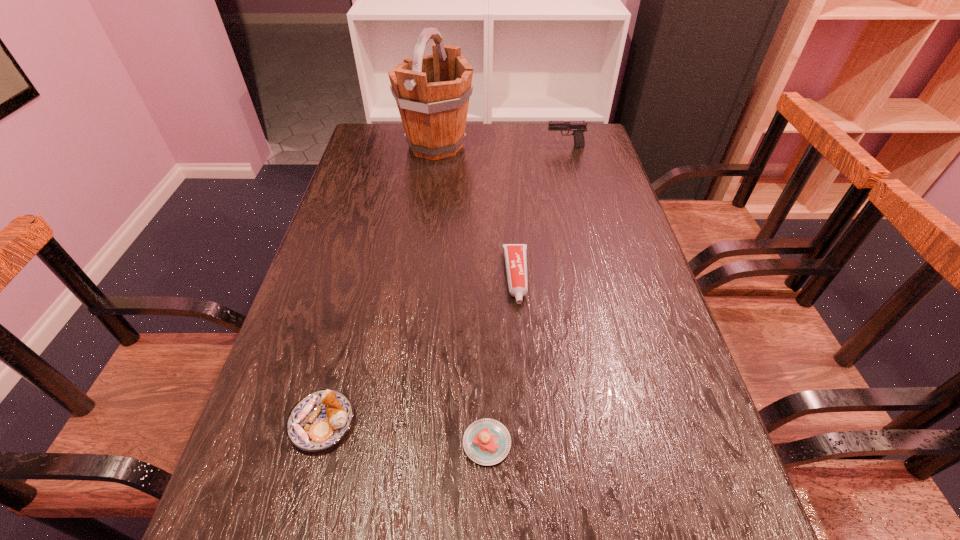
Locate an element on the screen. This screenshot has width=960, height=540. object at the far left corner is located at coordinates (432, 92).

Identify the location of object that is at the far right corner. The height and width of the screenshot is (540, 960). (578, 127).

Identify the location of free region at the far edge of the desktop. The image size is (960, 540). (544, 126).

This screenshot has height=540, width=960. In order to click on vacant space at the right edge of the desktop in this screenshot , I will do `click(615, 211)`.

At what (x,y) coordinates should I click in order to perform the action: click on free space at the far left corner of the desktop. Please return your answer as a coordinate pair (x, y). The image size is (960, 540). Looking at the image, I should click on (397, 143).

Image resolution: width=960 pixels, height=540 pixels. What are the coordinates of `vacant area that lies between the third nearest object and the shortest object` in the screenshot? It's located at (502, 360).

Where is `free spot between the toothpaste and the tallest object`? free spot between the toothpaste and the tallest object is located at coordinates (476, 212).

At what (x,y) coordinates should I click in order to perform the action: click on free point between the shorter pastry and the rightmost object. Please return your answer as a coordinate pair (x, y). Looking at the image, I should click on (526, 295).

Where is `vacant space that is in between the fourth shortest object and the left pastry`? vacant space that is in between the fourth shortest object and the left pastry is located at coordinates (444, 285).

You are a GUI agent. You are given a task and a screenshot of the screen. Output one action in this format:
    pyautogui.click(x=<x>, y=<y>)
    Task: Click on the empty space that is in between the right pastry and the toothpaste
    
    Given the screenshot: What is the action you would take?
    tap(502, 360)